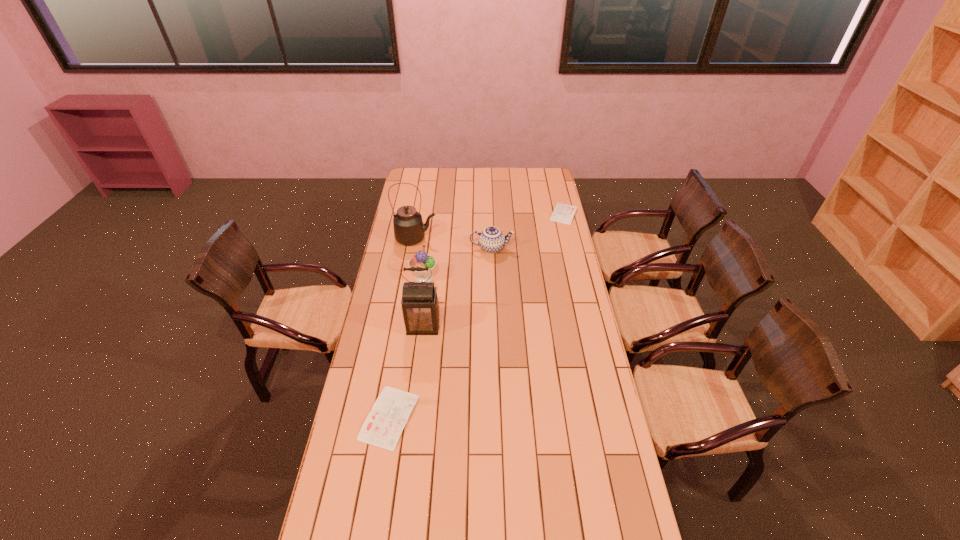
At what (x,y) coordinates should I click in order to perform the action: click on free spot located on the back of the left diary. Please return your answer as a coordinate pair (x, y). This screenshot has width=960, height=540. Looking at the image, I should click on (407, 308).

The height and width of the screenshot is (540, 960). Find the location of `free space located 0.210m on the left of the shorter diary`. free space located 0.210m on the left of the shorter diary is located at coordinates (511, 213).

The height and width of the screenshot is (540, 960). I want to click on free space located 0.110m on the left of the third tallest object, so click(387, 278).

Identify the location of vacant area situated at the spout of the fourth tallest object. Image resolution: width=960 pixels, height=540 pixels. (539, 248).

Where is `blank space located spout on the kettle`? The width and height of the screenshot is (960, 540). blank space located spout on the kettle is located at coordinates (483, 239).

Image resolution: width=960 pixels, height=540 pixels. I want to click on vacant area situated on the front-facing side of the second nearest object, so click(x=415, y=392).

You are a GUI agent. You are given a task and a screenshot of the screen. Output one action in this format:
    pyautogui.click(x=<x>, y=<y>)
    Task: Click on the diary at the left edge
    This screenshot has width=960, height=540.
    Given the screenshot: What is the action you would take?
    pyautogui.click(x=383, y=426)

Locate an element on the screen. This screenshot has width=960, height=540. icecream at the left edge is located at coordinates (421, 259).

Where is `kettle that is at the left edge`? This screenshot has width=960, height=540. kettle that is at the left edge is located at coordinates (409, 229).

Where is `lantern that is at the left edge`? Image resolution: width=960 pixels, height=540 pixels. lantern that is at the left edge is located at coordinates (420, 308).